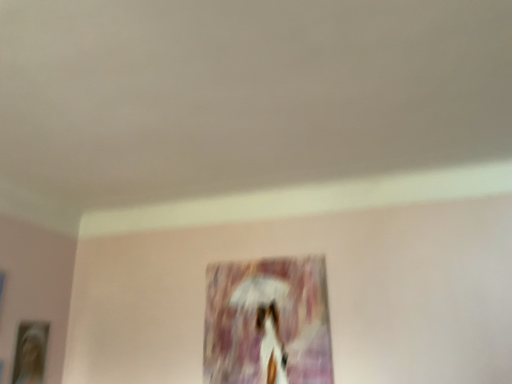
What do you see at coordinates (30, 353) in the screenshot? The image size is (512, 384). I see `wooden photo frame at lower left, the 2th picture frame when ordered from right to left` at bounding box center [30, 353].

The width and height of the screenshot is (512, 384). I want to click on wooden photo frame at lower left, the 1th picture frame viewed from the left, so click(x=30, y=353).

Measure the distance between matte purple painting at center, arranged as the 2th picture frame when viewed from the left, and camera.

The distance of matte purple painting at center, arranged as the 2th picture frame when viewed from the left, from camera is 1.86 meters.

Measure the distance between point (x=312, y=284) and camera.

Point (x=312, y=284) is 2.02 meters from camera.

The height and width of the screenshot is (384, 512). What do you see at coordinates (267, 322) in the screenshot? I see `matte purple painting at center, the first picture frame when ordered from right to left` at bounding box center [267, 322].

Find the location of a particular element. The height and width of the screenshot is (384, 512). matte purple painting at center, the first picture frame when ordered from right to left is located at coordinates 267,322.

This screenshot has height=384, width=512. I want to click on wooden photo frame at lower left, the 2th picture frame when ordered from right to left, so click(x=30, y=353).

Looking at this image, considering the positions of objects wooden photo frame at lower left, the 2th picture frame when ordered from right to left, and matte purple painting at center, the first picture frame when ordered from right to left, in the image provided, who is more to the right, wooden photo frame at lower left, the 2th picture frame when ordered from right to left, or matte purple painting at center, the first picture frame when ordered from right to left,?

From the viewer's perspective, matte purple painting at center, the first picture frame when ordered from right to left, appears more on the right side.

In the image, is wooden photo frame at lower left, the 1th picture frame viewed from the left, positioned in front of or behind matte purple painting at center, the first picture frame when ordered from right to left?

Clearly, wooden photo frame at lower left, the 1th picture frame viewed from the left, is behind matte purple painting at center, the first picture frame when ordered from right to left.

Considering the positions of points (34, 381) and (322, 373), is point (34, 381) closer to camera compared to point (322, 373)?

That is False.

From the image's perspective, which object appears higher, wooden photo frame at lower left, the 2th picture frame when ordered from right to left, or matte purple painting at center, arranged as the 2th picture frame when viewed from the left?

matte purple painting at center, arranged as the 2th picture frame when viewed from the left, appears higher in the image.

From a real-world perspective, between wooden photo frame at lower left, the 2th picture frame when ordered from right to left, and matte purple painting at center, arranged as the 2th picture frame when viewed from the left, who is vertically lower?

wooden photo frame at lower left, the 2th picture frame when ordered from right to left, from a real-world perspective.

From the picture: Considering the sizes of objects wooden photo frame at lower left, the 2th picture frame when ordered from right to left, and matte purple painting at center, the first picture frame when ordered from right to left, in the image provided, who is thinner, wooden photo frame at lower left, the 2th picture frame when ordered from right to left, or matte purple painting at center, the first picture frame when ordered from right to left,?

matte purple painting at center, the first picture frame when ordered from right to left, is thinner.

Which of these two, wooden photo frame at lower left, the 2th picture frame when ordered from right to left, or matte purple painting at center, arranged as the 2th picture frame when viewed from the left, stands taller?

With more height is matte purple painting at center, arranged as the 2th picture frame when viewed from the left.

Considering the sizes of objects wooden photo frame at lower left, the 2th picture frame when ordered from right to left, and matte purple painting at center, the first picture frame when ordered from right to left, in the image provided, who is smaller, wooden photo frame at lower left, the 2th picture frame when ordered from right to left, or matte purple painting at center, the first picture frame when ordered from right to left,?

With smaller size is wooden photo frame at lower left, the 2th picture frame when ordered from right to left.

Would you say wooden photo frame at lower left, the 2th picture frame when ordered from right to left, is inside or outside matte purple painting at center, arranged as the 2th picture frame when viewed from the left?

wooden photo frame at lower left, the 2th picture frame when ordered from right to left, cannot be found inside matte purple painting at center, arranged as the 2th picture frame when viewed from the left.

From the picture: Is wooden photo frame at lower left, the 2th picture frame when ordered from right to left, next to matte purple painting at center, arranged as the 2th picture frame when viewed from the left, and touching it?

No, wooden photo frame at lower left, the 2th picture frame when ordered from right to left, is not next to matte purple painting at center, arranged as the 2th picture frame when viewed from the left.

Could you tell me if wooden photo frame at lower left, the 2th picture frame when ordered from right to left, is turned towards matte purple painting at center, arranged as the 2th picture frame when viewed from the left?

Yes, wooden photo frame at lower left, the 2th picture frame when ordered from right to left, is turned towards matte purple painting at center, arranged as the 2th picture frame when viewed from the left.

Locate an element on the screen. This screenshot has height=384, width=512. picture frame on the left of matte purple painting at center, arranged as the 2th picture frame when viewed from the left is located at coordinates (30, 353).

Considering the positions of objects matte purple painting at center, arranged as the 2th picture frame when viewed from the left, and wooden photo frame at lower left, the 2th picture frame when ordered from right to left, in the image provided, who is more to the right, matte purple painting at center, arranged as the 2th picture frame when viewed from the left, or wooden photo frame at lower left, the 2th picture frame when ordered from right to left,?

matte purple painting at center, arranged as the 2th picture frame when viewed from the left.

Looking at this image, which object is closer to the camera, matte purple painting at center, arranged as the 2th picture frame when viewed from the left, or wooden photo frame at lower left, the 1th picture frame viewed from the left?

matte purple painting at center, arranged as the 2th picture frame when viewed from the left.

Between point (278, 368) and point (34, 371), which one is positioned in front?

Point (278, 368)

From the image's perspective, which one is positioned higher, matte purple painting at center, the first picture frame when ordered from right to left, or wooden photo frame at lower left, the 2th picture frame when ordered from right to left?

matte purple painting at center, the first picture frame when ordered from right to left, from the image's perspective.

From a real-world perspective, is matte purple painting at center, arranged as the 2th picture frame when viewed from the left, physically above wooden photo frame at lower left, the 2th picture frame when ordered from right to left?

Yes, from a real-world perspective, matte purple painting at center, arranged as the 2th picture frame when viewed from the left, is on top of wooden photo frame at lower left, the 2th picture frame when ordered from right to left.

Considering the relative sizes of matte purple painting at center, the first picture frame when ordered from right to left, and wooden photo frame at lower left, the 2th picture frame when ordered from right to left, in the image provided, is matte purple painting at center, the first picture frame when ordered from right to left, wider than wooden photo frame at lower left, the 2th picture frame when ordered from right to left,?

In fact, matte purple painting at center, the first picture frame when ordered from right to left, might be narrower than wooden photo frame at lower left, the 2th picture frame when ordered from right to left.

Who is taller, matte purple painting at center, the first picture frame when ordered from right to left, or wooden photo frame at lower left, the 1th picture frame viewed from the left?

matte purple painting at center, the first picture frame when ordered from right to left.

Looking at the image, does matte purple painting at center, arranged as the 2th picture frame when viewed from the left, seem bigger or smaller compared to wooden photo frame at lower left, the 2th picture frame when ordered from right to left?

Considering their sizes, matte purple painting at center, arranged as the 2th picture frame when viewed from the left, takes up more space than wooden photo frame at lower left, the 2th picture frame when ordered from right to left.

Is matte purple painting at center, arranged as the 2th picture frame when viewed from the left, located outside wooden photo frame at lower left, the 2th picture frame when ordered from right to left?

matte purple painting at center, arranged as the 2th picture frame when viewed from the left, lies outside wooden photo frame at lower left, the 2th picture frame when ordered from right to left,'s area.

Is matte purple painting at center, arranged as the 2th picture frame when viewed from the left, touching wooden photo frame at lower left, the 2th picture frame when ordered from right to left?

No, matte purple painting at center, arranged as the 2th picture frame when viewed from the left, is not touching wooden photo frame at lower left, the 2th picture frame when ordered from right to left.

Is matte purple painting at center, the first picture frame when ordered from right to left, turned away from wooden photo frame at lower left, the 1th picture frame viewed from the left?

No, matte purple painting at center, the first picture frame when ordered from right to left, is not facing the opposite direction of wooden photo frame at lower left, the 1th picture frame viewed from the left.

Locate an element on the screen. The width and height of the screenshot is (512, 384). picture frame on the right of wooden photo frame at lower left, the 1th picture frame viewed from the left is located at coordinates (267, 322).

Locate an element on the screen. The height and width of the screenshot is (384, 512). picture frame in front of the wooden photo frame at lower left, the 2th picture frame when ordered from right to left is located at coordinates (267, 322).

Identify the location of picture frame located on the left of matte purple painting at center, arranged as the 2th picture frame when viewed from the left. The width and height of the screenshot is (512, 384). (30, 353).